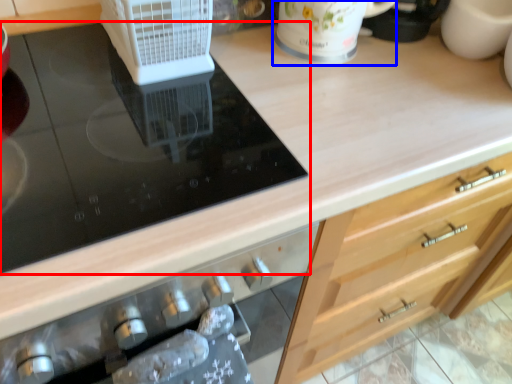
Question: Which object appears farthest to the camera in this image, gas stove (highlighted by a red box) or mug (highlighted by a blue box)?

Choices:
 (A) gas stove
 (B) mug

Answer: (B)